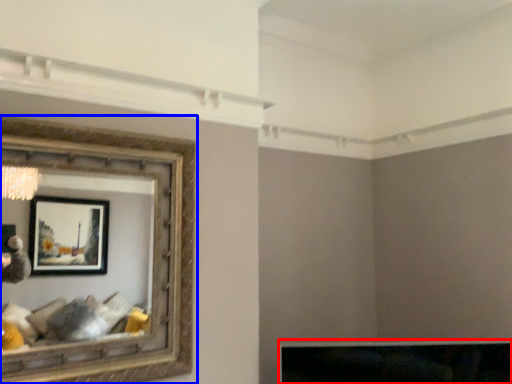
Question: Which point is further to the camera, furniture (highlighted by a red box) or picture frame (highlighted by a blue box)?

Choices:
 (A) furniture
 (B) picture frame

Answer: (A)